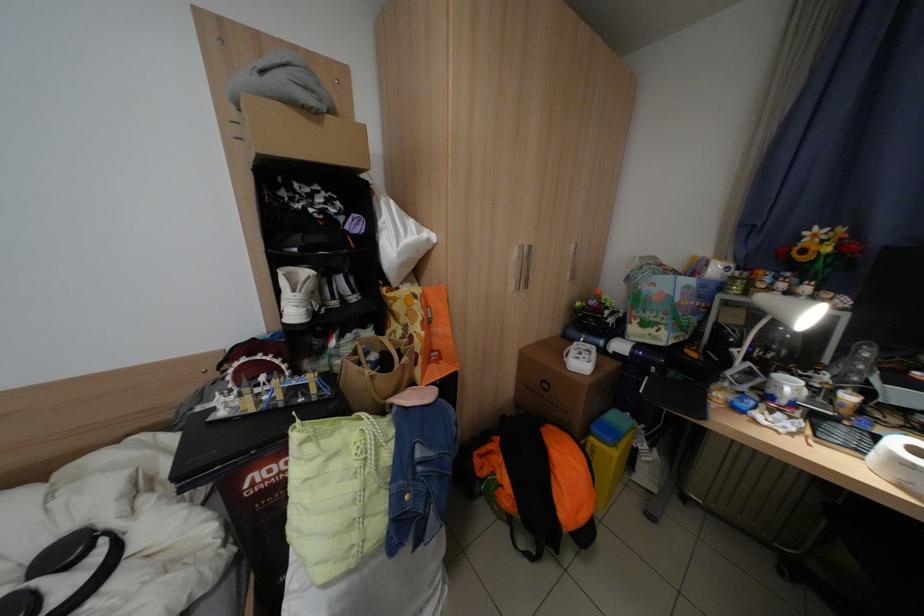
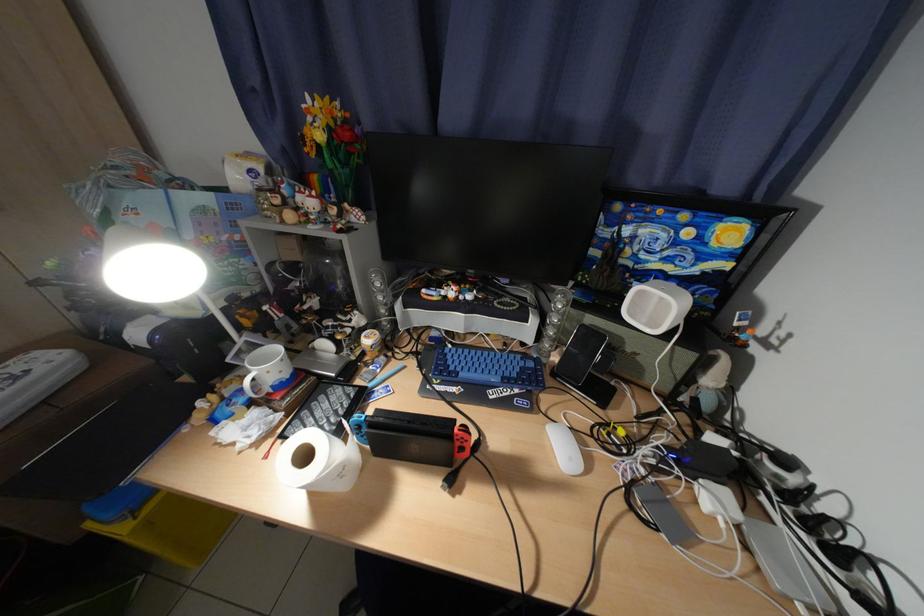
The point at (840, 251) is marked in the first image. Where is the corresponding point in the second image?

(331, 138)